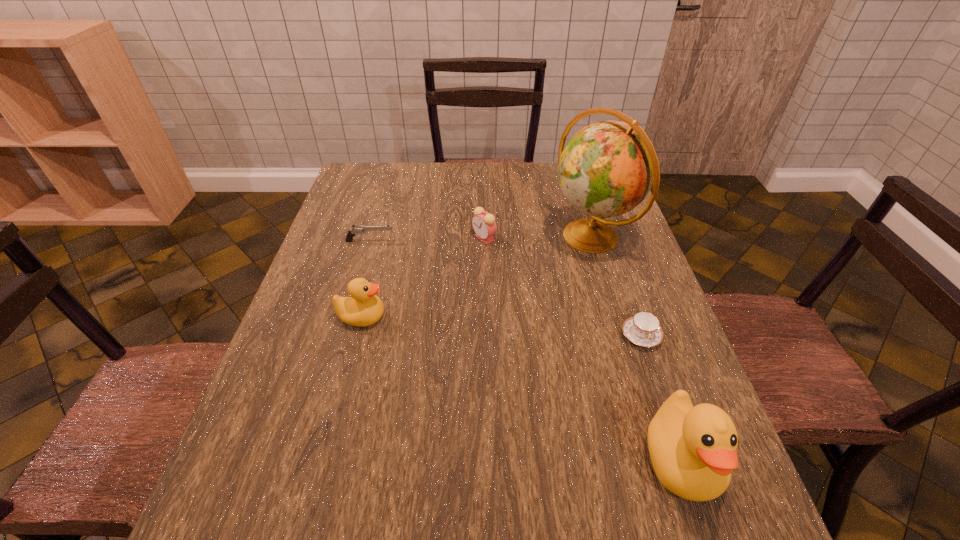
I want to click on blank region between the third shortest object and the third tallest object, so click(x=423, y=278).

The width and height of the screenshot is (960, 540). In order to click on vacant space that is in between the third object from left to right and the tallest object in this screenshot , I will do `click(538, 237)`.

Where is `empty space that is in between the fourth object from right to left and the teacup`? Image resolution: width=960 pixels, height=540 pixels. empty space that is in between the fourth object from right to left and the teacup is located at coordinates (563, 287).

At what (x,y) coordinates should I click in order to perform the action: click on free spot between the alarm clock and the left duck. Please return your answer as a coordinate pair (x, y). The width and height of the screenshot is (960, 540). Looking at the image, I should click on [423, 278].

Find the location of a particular element. Image resolution: width=960 pixels, height=540 pixels. empty location between the third tallest object and the teacup is located at coordinates (501, 326).

Locate an element on the screen. unoccupied position between the tallest object and the nearer duck is located at coordinates pyautogui.click(x=636, y=348).

At what (x,y) coordinates should I click in order to perform the action: click on free space between the second tallest object and the tallest object. Please return your answer as a coordinate pair (x, y). Image resolution: width=960 pixels, height=540 pixels. Looking at the image, I should click on tap(636, 348).

Select which object appears as the closest to the third tallest object. Please provide its 2D coordinates. Your answer should be formatted as a tuple, i.e. [(x, y)], where the tuple contains the x and y coordinates of a point satisfying the conditions above.

[(355, 230)]

Identify which object is the closest to the alarm clock. Please provide its 2D coordinates. Your answer should be formatted as a tuple, i.e. [(x, y)], where the tuple contains the x and y coordinates of a point satisfying the conditions above.

[(606, 169)]